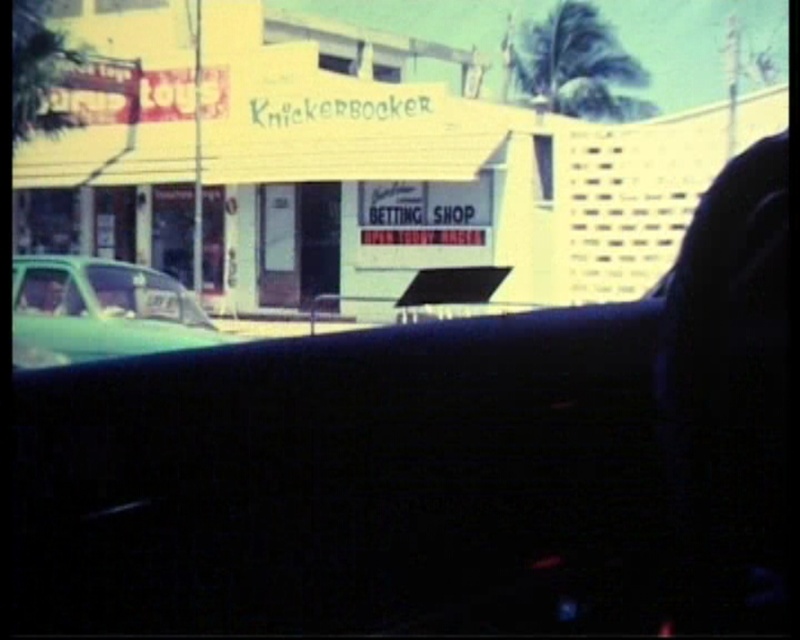
Question: Which object is the farthest from the green matte windshield at lower left?

Choices:
 (A) teal glossy car at left
 (B) clear glass window at left

Answer: (A)

Question: Which point is farther to the camera?

Choices:
 (A) green matte windshield at lower left
 (B) clear glass window at left

Answer: (A)

Question: Is green matte windshield at lower left to the right of clear glass window at left from the viewer's perspective?

Choices:
 (A) yes
 (B) no

Answer: (B)

Question: Estimate the real-world distances between objects in this image. Which object is farther from the clear glass window at left?

Choices:
 (A) green matte windshield at lower left
 (B) teal glossy car at left

Answer: (A)

Question: Observing the image, what is the correct spatial positioning of green matte windshield at lower left in reference to clear glass window at left?

Choices:
 (A) below
 (B) above

Answer: (B)

Question: Does teal glossy car at left lie in front of clear glass window at left?

Choices:
 (A) no
 (B) yes

Answer: (B)